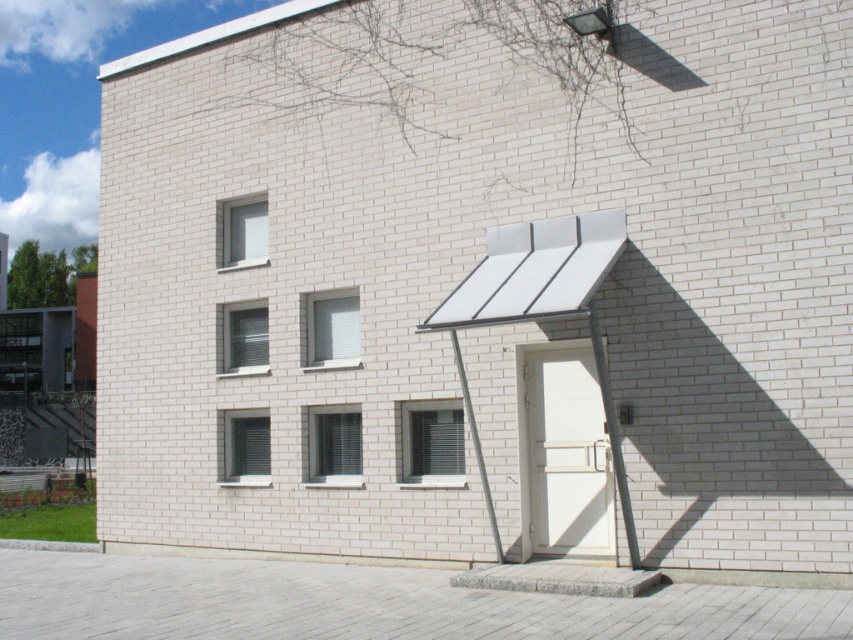
The width and height of the screenshot is (853, 640). I want to click on white textured window at center, so (432, 444).

Is white textured window at center smaller than white matte window at center?

No, white textured window at center is not smaller than white matte window at center.

Where is `white textured window at center`? white textured window at center is located at coordinates (432, 444).

Identify the location of white textured window at center. (432, 444).

How distant is white matte pole at center from metallic gray pole at center?

A distance of 4.74 feet exists between white matte pole at center and metallic gray pole at center.

Is white matte pole at center positioned before metallic gray pole at center?

Yes, white matte pole at center is in front of metallic gray pole at center.

Who is more forward, [627,515] or [462,401]?

Positioned in front is point [627,515].

Find the location of a particular element. The height and width of the screenshot is (640, 853). white matte pole at center is located at coordinates (613, 436).

Is point (309, 426) less distant than point (250, 221)?

Yes, it is in front of point (250, 221).

Can you confirm if clear glass window at center is positioned above white glass window at upper center?

Actually, clear glass window at center is below white glass window at upper center.

Describe the element at coordinates (334, 445) in the screenshot. I see `clear glass window at center` at that location.

I want to click on clear glass window at center, so click(334, 445).